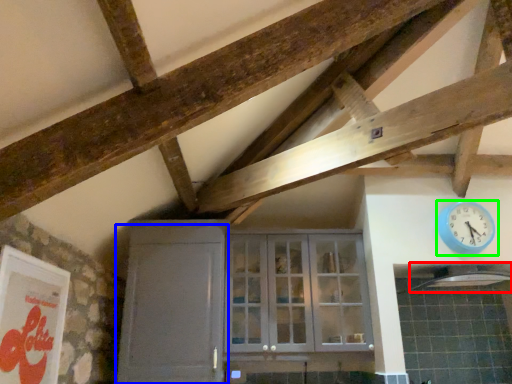
Question: Estimate the real-world distances between objects in this image. Which object is farther from exhaust hood (highlighted by a red box), door (highlighted by a blue box) or wall clock (highlighted by a green box)?

Choices:
 (A) door
 (B) wall clock

Answer: (A)